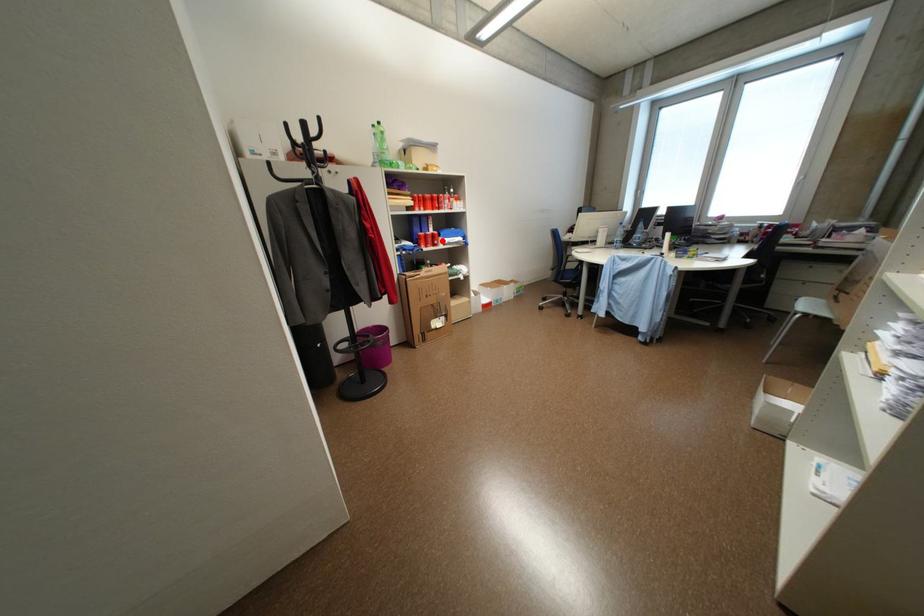
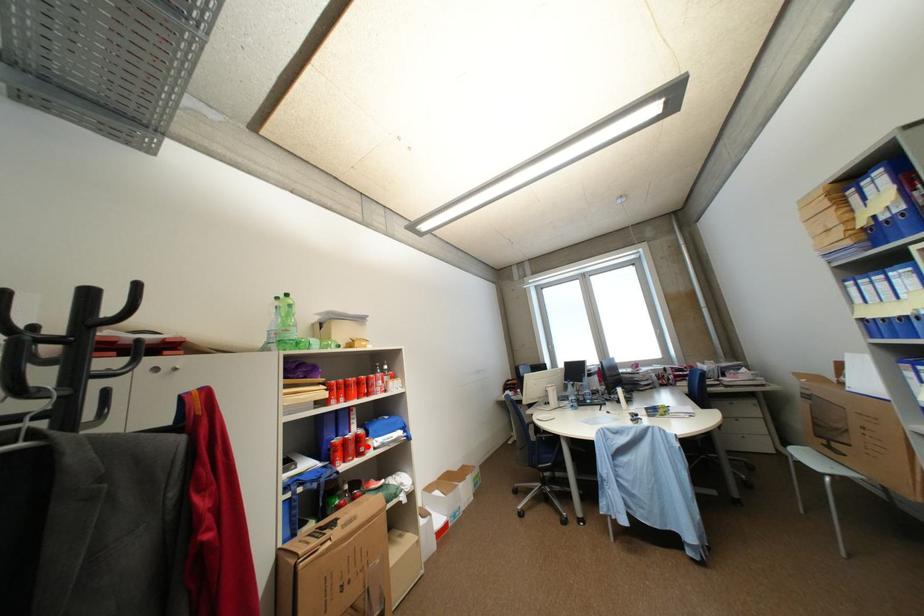
I am providing you with two images of the same scene from different viewpoints. A red point is marked on the first image and another point is marked on the second image. Does the point marked in image1 correspond to the same location as the one in image2?

Yes